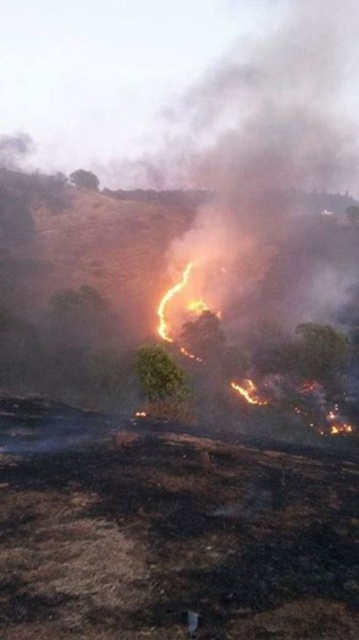
You are a firefighter assessing the wildfire scene. You notice a charcoal ash hillside at center and a green leafy tree at center. Which of these two landmarks is positioned to the left when viewed from your perspective?

The charcoal ash hillside at center is to the left of the green leafy tree at center, so the charcoal ash hillside at center is positioned to the left.

You are a firefighter assessing the wildfire scene. You notice two green leafy trees in the image. Which tree is positioned lower in the image, the green leafy tree at center or the green leafy tree at upper center?

The green leafy tree at center is positioned lower in the image as it is located below the green leafy tree at upper center.